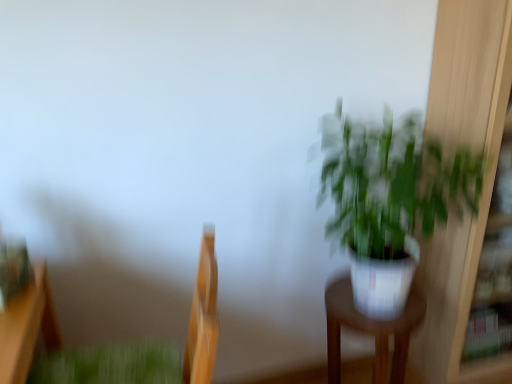
Find the location of a particular element. The height and width of the screenshot is (384, 512). white glossy pot at right is located at coordinates (389, 200).

Is wooden swivel chair at left not inside white glossy pot at right?

Absolutely, wooden swivel chair at left is external to white glossy pot at right.

Is wooden swivel chair at left thinner than white glossy pot at right?

No, wooden swivel chair at left is not thinner than white glossy pot at right.

Does point (209, 369) come closer to viewer compared to point (418, 209)?

That is True.

Measure the distance between wooden swivel chair at left and white glossy pot at right.

wooden swivel chair at left is 86.45 centimeters away from white glossy pot at right.

The image size is (512, 384). I want to click on swivel chair in front of the white glossy pot at center-right, so click(x=149, y=345).

Does white glossy pot at center-right contain wooden swivel chair at left?

No, wooden swivel chair at left is not a part of white glossy pot at center-right.

In terms of size, does white glossy pot at center-right appear bigger or smaller than wooden swivel chair at left?

In the image, white glossy pot at center-right appears to be smaller than wooden swivel chair at left.

From the image's perspective, which is below, white glossy pot at center-right or wooden swivel chair at left?

white glossy pot at center-right is shown below in the image.

Between white glossy pot at center-right and white glossy pot at right, which one has less height?

white glossy pot at center-right is shorter.

From the image's perspective, does white glossy pot at center-right appear lower than white glossy pot at right?

Yes.

Considering the relative sizes of white glossy pot at center-right and white glossy pot at right in the image provided, is white glossy pot at center-right wider than white glossy pot at right?

In fact, white glossy pot at center-right might be narrower than white glossy pot at right.

Would you say white glossy pot at center-right is a long distance from white glossy pot at right?

white glossy pot at center-right is near white glossy pot at right, not far away.

Which is behind, point (161, 358) or point (145, 360)?

The point (161, 358) is behind.

Based on the photo, which of these two, wooden swivel chair at left or green matte plant at lower left, is thinner?

green matte plant at lower left is thinner.

From the image's perspective, is wooden swivel chair at left located above green matte plant at lower left?

Correct, wooden swivel chair at left appears higher than green matte plant at lower left in the image.

Is green matte plant at lower left facing away from white glossy pot at right?

green matte plant at lower left is not turned away from white glossy pot at right.

From a real-world perspective, is green matte plant at lower left under white glossy pot at right?

Correct, in the physical world, green matte plant at lower left is lower than white glossy pot at right.

Looking at this image, considering the sizes of objects green matte plant at lower left and white glossy pot at right in the image provided, who is wider, green matte plant at lower left or white glossy pot at right?

white glossy pot at right.

Does green matte plant at lower left have a lesser width compared to white glossy pot at center-right?

Incorrect, the width of green matte plant at lower left is not less than that of white glossy pot at center-right.

Is white glossy pot at center-right inside green matte plant at lower left?

No, white glossy pot at center-right is not inside green matte plant at lower left.

Is green matte plant at lower left aimed at white glossy pot at center-right?

No, green matte plant at lower left is not turned towards white glossy pot at center-right.

From a real-world perspective, does green matte plant at lower left sit lower than white glossy pot at center-right?

No, from a real-world perspective, green matte plant at lower left is not beneath white glossy pot at center-right.

From a real-world perspective, is white glossy pot at right above or below white glossy pot at center-right?

Clearly, from a real-world perspective, white glossy pot at right is above white glossy pot at center-right.

Is white glossy pot at right closer to the viewer compared to white glossy pot at center-right?

Yes, it is.

Can you tell me how much white glossy pot at right and white glossy pot at center-right differ in facing direction?

They differ by 2.14 degrees in their facing directions.

Is white glossy pot at right aimed at white glossy pot at center-right?

No.

The width and height of the screenshot is (512, 384). I want to click on swivel chair below the white glossy pot at right (from a real-world perspective), so click(149, 345).

Locate an element on the screen. This screenshot has height=384, width=512. swivel chair above the white glossy pot at center-right (from the image's perspective) is located at coordinates (149, 345).

When comparing their distances from white glossy pot at right, does wooden swivel chair at left or white glossy pot at center-right seem closer?

Among the two, white glossy pot at center-right is located nearer to white glossy pot at right.

Which object lies further to the anchor point green matte plant at lower left, white glossy pot at center-right or white glossy pot at right?

white glossy pot at right is positioned further to the anchor green matte plant at lower left.

Looking at the image, which one is located further to white glossy pot at center-right, green matte plant at lower left or white glossy pot at right?

green matte plant at lower left lies further to white glossy pot at center-right than the other object.

When comparing their distances from wooden swivel chair at left, does white glossy pot at center-right or white glossy pot at right seem closer?

Among the two, white glossy pot at center-right is located nearer to wooden swivel chair at left.

Looking at the image, which one is located closer to wooden swivel chair at left, white glossy pot at right or green matte plant at lower left?

green matte plant at lower left.

Which object lies further to the anchor point green matte plant at lower left, white glossy pot at center-right or wooden swivel chair at left?

white glossy pot at center-right is positioned further to the anchor green matte plant at lower left.

Based on their spatial positions, is green matte plant at lower left or white glossy pot at center-right closer to wooden swivel chair at left?

Based on the image, green matte plant at lower left appears to be nearer to wooden swivel chair at left.

Estimate the real-world distances between objects in this image. Which object is further from green matte plant at lower left, white glossy pot at right or wooden swivel chair at left?

Among the two, white glossy pot at right is located further to green matte plant at lower left.

Identify the location of swivel chair situated between green matte plant at lower left and white glossy pot at center-right from left to right. (149, 345).

Locate an element on the screen. The height and width of the screenshot is (384, 512). furniture between green matte plant at lower left and white glossy pot at right is located at coordinates (371, 330).

Identify the location of furniture located between wooden swivel chair at left and white glossy pot at right in the left-right direction. (371, 330).

Where is `swivel chair between green matte plant at lower left and white glossy pot at right from left to right`? The width and height of the screenshot is (512, 384). swivel chair between green matte plant at lower left and white glossy pot at right from left to right is located at coordinates (149, 345).